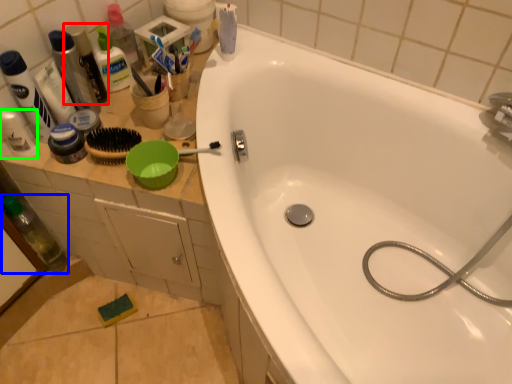
Question: Estimate the real-world distances between objects in this image. Which object is farther from toiletry (highlighted by a red box), bottle (highlighted by a blue box) or toiletry (highlighted by a green box)?

Choices:
 (A) bottle
 (B) toiletry

Answer: (A)